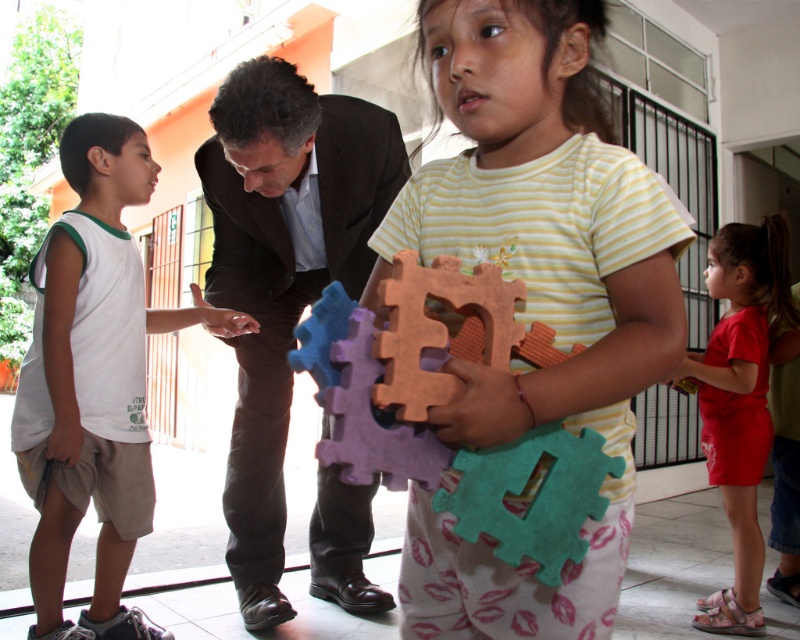
Does point (366, 248) come behind point (712, 369)?

No, (366, 248) is closer to viewer.

Is point (358, 595) in front of point (756, 504)?

Yes.

This screenshot has width=800, height=640. Identify the location of dark brown suit at center. (284, 273).

Which is above, matte plastic puzzle pieces at center or white cotton shirt at left?

matte plastic puzzle pieces at center

Between matte plastic puzzle pieces at center and white cotton shirt at left, which one has more height?

With more height is white cotton shirt at left.

Is point (440, 212) less distant than point (134, 529)?

Yes, point (440, 212) is closer to viewer.

The image size is (800, 640). Identify the location of matte plastic puzzle pieces at center. (534, 296).

Is dark brown suit at center smaller than white cotton shirt at left?

No.

At what (x,y) coordinates should I click in order to perform the action: click on dark brown suit at center. Please return your answer as a coordinate pair (x, y). Looking at the image, I should click on (284, 273).

Locate an element on the screen. The height and width of the screenshot is (640, 800). dark brown suit at center is located at coordinates (284, 273).